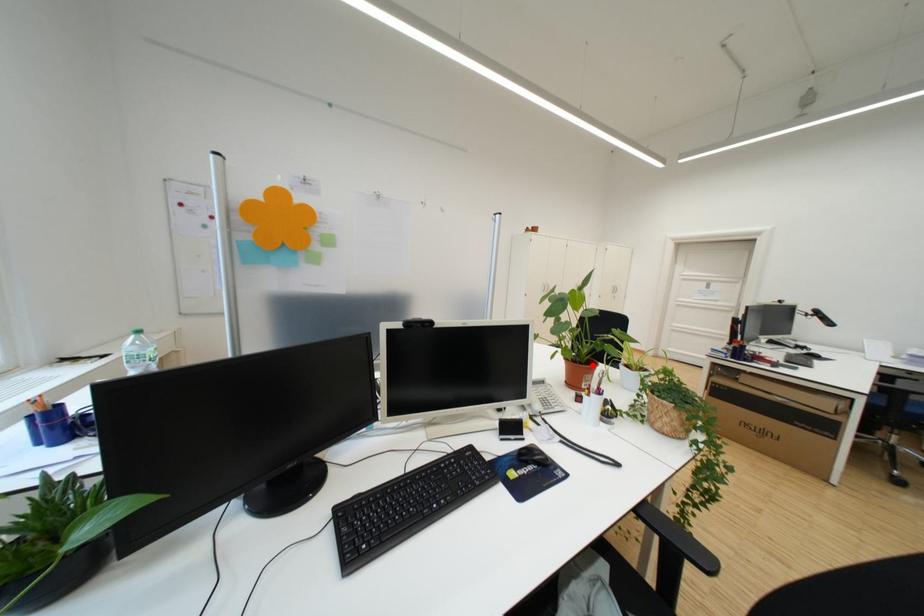
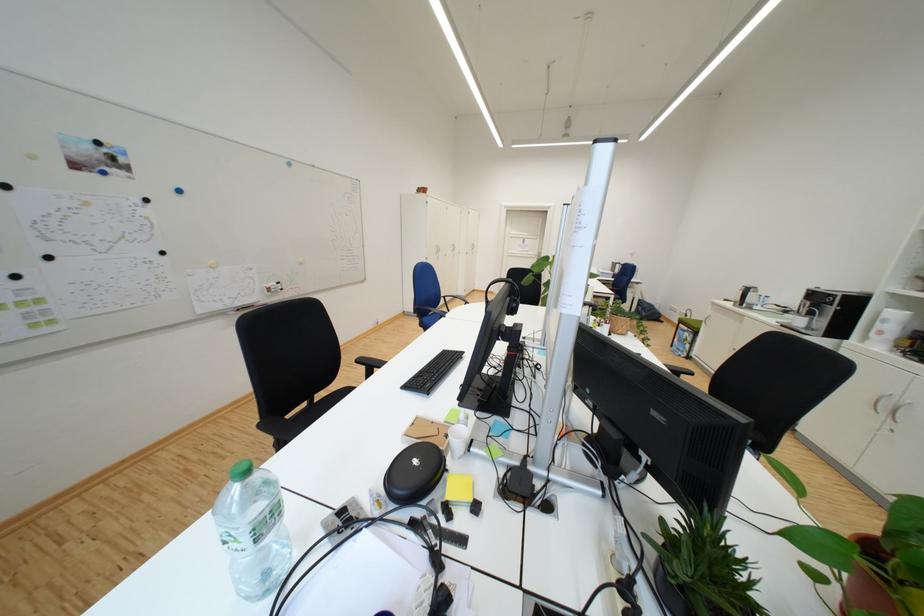
Question: I am providing you with two images of the same scene from different viewpoints. A red point is marked on the first image. At the location where the point appears in image 1, is it still visible in image 2?

Choices:
 (A) Yes
 (B) No

Answer: (B)